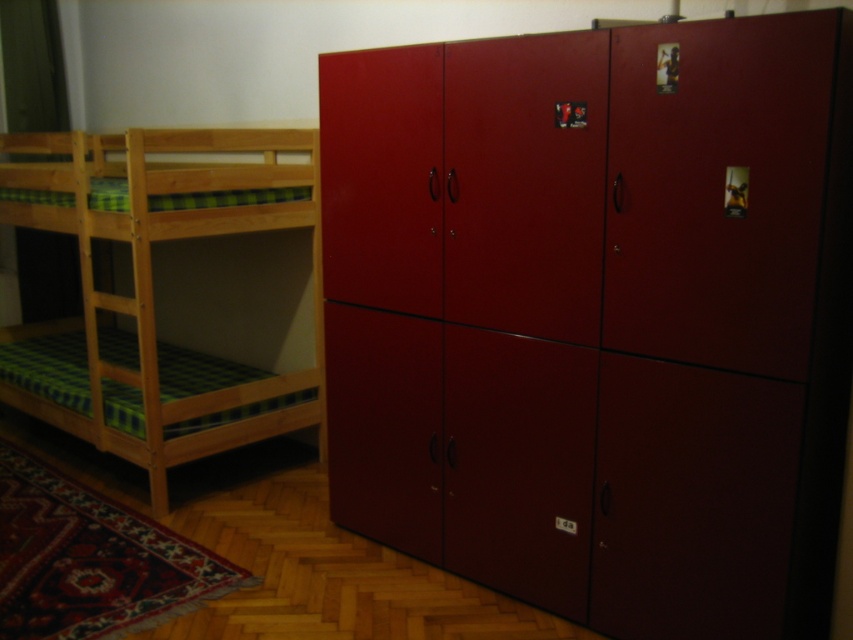
Question: Does glossy wood dresser at right appear over light brown wooden bunk bed at left?

Choices:
 (A) no
 (B) yes

Answer: (A)

Question: Can you confirm if glossy wood dresser at right is thinner than light brown wooden bunk bed at left?

Choices:
 (A) yes
 (B) no

Answer: (A)

Question: Is glossy wood dresser at right further to the viewer compared to light brown wooden bunk bed at left?

Choices:
 (A) no
 (B) yes

Answer: (A)

Question: Which of the following is the closest to the observer?

Choices:
 (A) glossy wood dresser at right
 (B) light brown wooden bunk bed at left

Answer: (A)